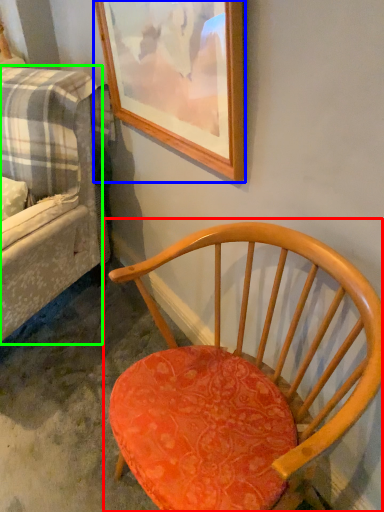
Question: Considering the real-world distances, which object is farthest from chair (highlighted by a red box)? picture frame (highlighted by a blue box) or studio couch (highlighted by a green box)?

Choices:
 (A) picture frame
 (B) studio couch

Answer: (B)